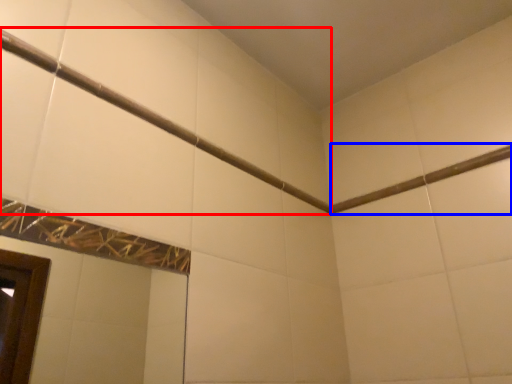
Question: Which of the following is the closest to the observer, shower (highlighted by a red box) or beam (highlighted by a blue box)?

Choices:
 (A) shower
 (B) beam

Answer: (A)